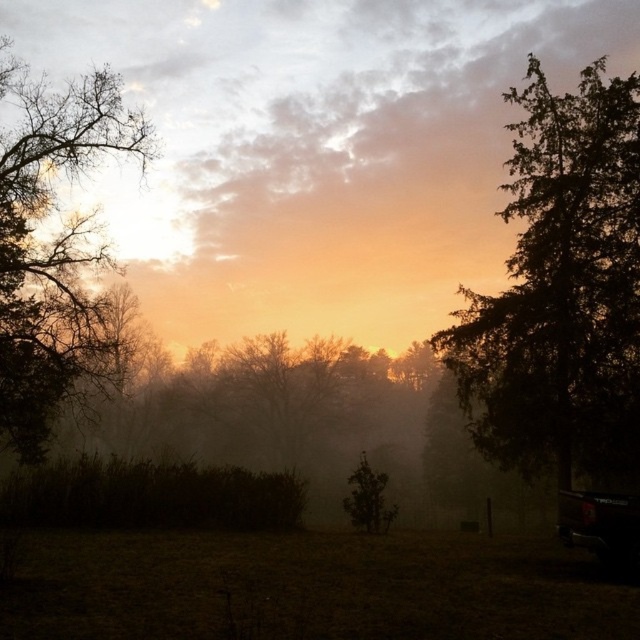
Question: Which object is positioned closest to the green textured tree at right?

Choices:
 (A) bare branches at left
 (B) black matte truck at lower right
 (C) green matte tree at center
 (D) foggy mist at center

Answer: (C)

Question: Does black matte truck at lower right appear under green matte tree at center?

Choices:
 (A) no
 (B) yes

Answer: (A)

Question: Which of the following is the closest to the observer?

Choices:
 (A) (115, 376)
 (B) (637, 120)
 (C) (627, 552)
 (D) (412, 196)

Answer: (C)

Question: Which of the following is the farthest from the observer?

Choices:
 (A) bare branches at left
 (B) green textured tree at right

Answer: (A)

Question: Can you confirm if green textured tree at right is bigger than black matte truck at lower right?

Choices:
 (A) yes
 (B) no

Answer: (A)

Question: Can you confirm if bare branches at left is wider than black matte truck at lower right?

Choices:
 (A) yes
 (B) no

Answer: (A)